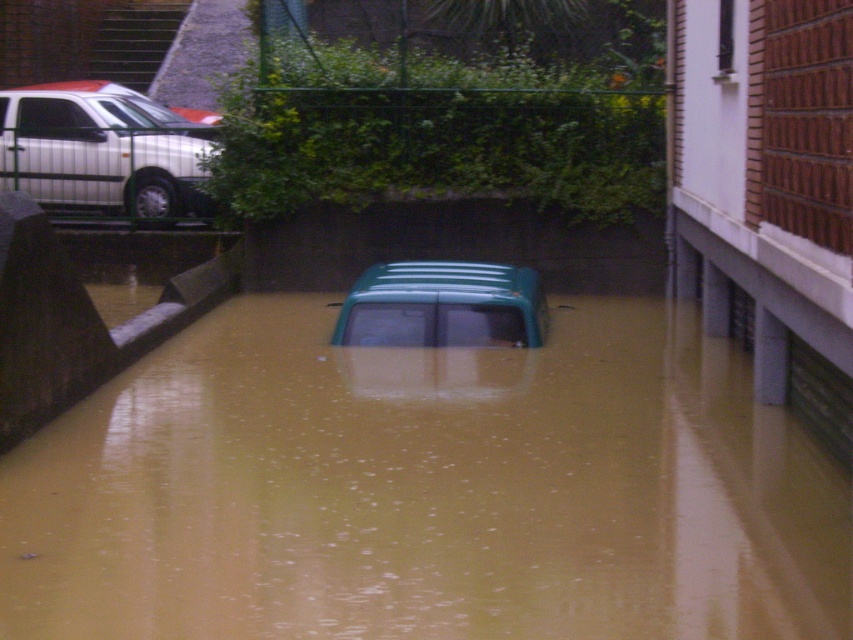
You are a rescue worker trying to reach the green car in the flooded area. You see the brown murky water at center and the silver metallic van at upper left. Which object is closer to the green car?

The brown murky water at center is closer to the green car because it is located below the silver metallic van at upper left, meaning the van is farther away from the car.

You are a delivery driver who needs to park your truck between the silver metallic van at upper left and the green matte van at center. The parking space between them is 2.5 meters wide. Can your truck, which is 2.2 meters wide, fit in this space?

The silver metallic van at upper left is wider than the green matte van at center. The parking space between them is 2.5 meters wide, so your truck, which is 2.2 meters wide, can fit in this space.

You are a delivery driver trying to navigate through the flooded area shown in the image. You need to reach the green matte van at center. Considering the brown murky water at center, will the water be too deep for your vehicle to pass through?

The brown murky water at center is narrower than the green matte van at center. Since the water is less wide than the van, it might not cover the entire path, so the depth could be manageable for your vehicle to pass through the area.